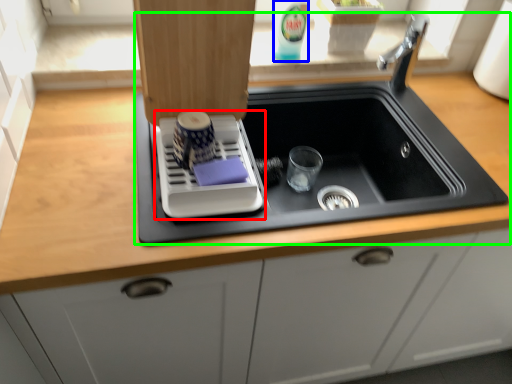
Question: Based on their relative distances, which object is farther from appliance (highlighted by a red box)? Choose from beverage (highlighted by a blue box) and sink (highlighted by a green box).

Choices:
 (A) beverage
 (B) sink

Answer: (A)